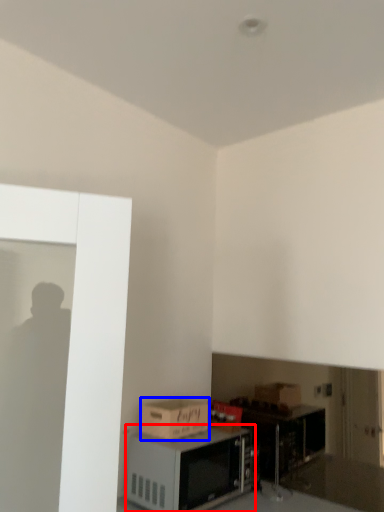
Question: Which object appears farthest to the camera in this image, microwave (highlighted by a red box) or cardboard box (highlighted by a blue box)?

Choices:
 (A) microwave
 (B) cardboard box

Answer: (B)